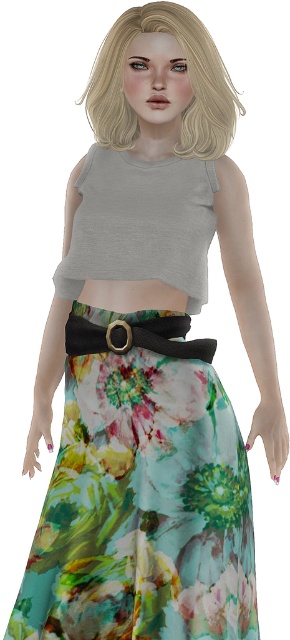
Is blondehair at upper center to the right of matte black belt at center from the viewer's perspective?

Yes, blondehair at upper center is to the right of matte black belt at center.

Is blondehair at upper center closer to camera compared to matte black belt at center?

No, blondehair at upper center is behind matte black belt at center.

The height and width of the screenshot is (640, 290). What do you see at coordinates (189, 83) in the screenshot?
I see `blondehair at upper center` at bounding box center [189, 83].

I want to click on blondehair at upper center, so [x=189, y=83].

Is point (182, 444) positioned before point (203, 353)?

Yes, point (182, 444) is in front of point (203, 353).

Is floral chiffon skirt at lower center taller than matte black belt at center?

Correct, floral chiffon skirt at lower center is much taller as matte black belt at center.

Identify the location of floral chiffon skirt at lower center. (142, 497).

Does floral chiffon skirt at lower center have a greater height compared to blondehair at upper center?

Yes, floral chiffon skirt at lower center is taller than blondehair at upper center.

Who is more distant from viewer, (156, 384) or (118, 120)?

The point (118, 120) is behind.

The height and width of the screenshot is (640, 290). Find the location of `floral chiffon skirt at lower center`. floral chiffon skirt at lower center is located at coordinates (142, 497).